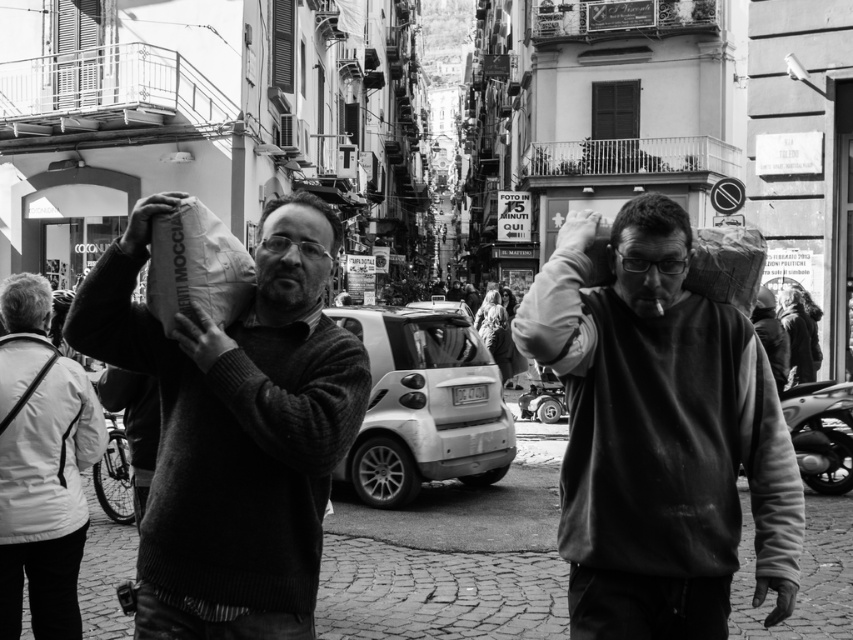
Based on the scene description, where is the white fabric bag at left located in the image?

The white fabric bag at left is located at the 2D coordinates of point (41, 467) in the image.

You are standing at point (148, 317) and want to walk to the nearest building entrance. The two men are 19.58 feet apart. Which direction should you go?

Since the two men are 19.58 feet apart, you should go towards the nearest building entrance in the direction opposite to the men to avoid them.

In the black and white photo, there are two men in the foreground. One has a knitted sweater at center and the other has smooth gray hair at upper left. Which man is positioned lower in the image?

The knitted sweater at center is below smooth gray hair at upper left, so the man with the knitted sweater at center is positioned lower in the image.